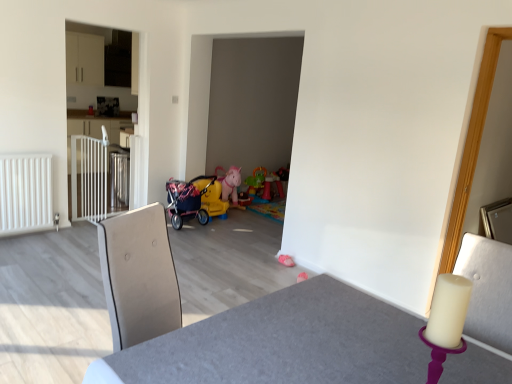
This screenshot has height=384, width=512. Find the location of `unoccupied region to the right of white matte radiator at left`. unoccupied region to the right of white matte radiator at left is located at coordinates (60, 239).